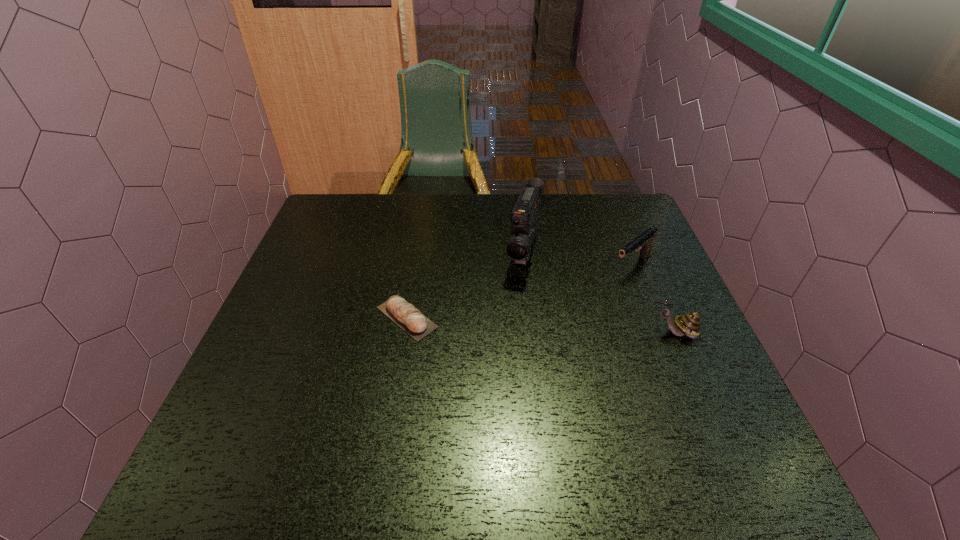
You are a GUI agent. You are given a task and a screenshot of the screen. Output one action in this format:
    pyautogui.click(x=<x>, y=<y>)
    Task: Click on the shortest object
    The image size is (960, 540).
    Given the screenshot: What is the action you would take?
    pyautogui.click(x=405, y=315)

You are a GUI agent. You are given a task and a screenshot of the screen. Output one action in this format:
    pyautogui.click(x=<x>, y=<y>)
    Task: Click on the leftmost object
    This screenshot has height=540, width=960.
    Given the screenshot: What is the action you would take?
    pyautogui.click(x=405, y=315)

Where is `snail`? This screenshot has height=540, width=960. snail is located at coordinates (689, 324).

The image size is (960, 540). What are the coordinates of `pistol` in the screenshot? It's located at pos(644,241).

This screenshot has width=960, height=540. I want to click on camcorder, so click(524, 218).

At what (x,y) coordinates should I click in order to perform the action: click on the third object from right to left. Please return your answer as a coordinate pair (x, y). The height and width of the screenshot is (540, 960). Looking at the image, I should click on (524, 218).

Where is `free location located 0.230m on the left of the leftmost object`? free location located 0.230m on the left of the leftmost object is located at coordinates (280, 318).

You are a GUI agent. You are given a task and a screenshot of the screen. Output one action in this format:
    pyautogui.click(x=<x>, y=<y>)
    Task: Click on the vacant space located 0.230m on the face of the snail
    Image resolution: width=960 pixels, height=540 pixels.
    Given the screenshot: What is the action you would take?
    pyautogui.click(x=556, y=333)

You are a GUI agent. You are given a task and a screenshot of the screen. Output one action in this format:
    pyautogui.click(x=<x>, y=<y>)
    Task: Click on the free space located 0.330m on the face of the snail
    This screenshot has width=960, height=540.
    Given the screenshot: What is the action you would take?
    pyautogui.click(x=514, y=333)

Identify the location of blank space located on the face of the snail. (530, 333).